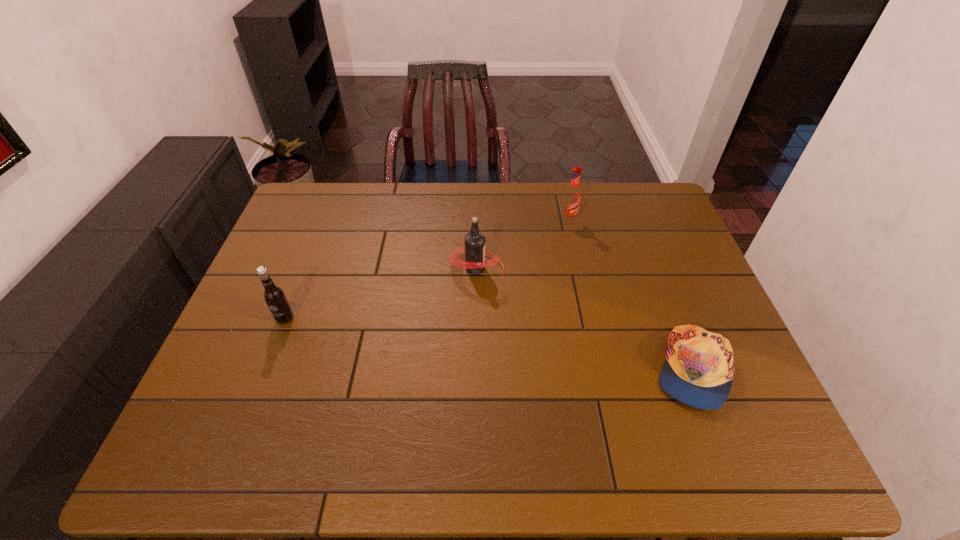
Image resolution: width=960 pixels, height=540 pixels. I want to click on the rightmost root beer, so click(571, 200).

Where is `the second object from right to left`? The image size is (960, 540). the second object from right to left is located at coordinates (571, 200).

Locate an element on the screen. Image resolution: width=960 pixels, height=540 pixels. the third nearest object is located at coordinates (475, 242).

You are a GUI agent. You are given a task and a screenshot of the screen. Output one action in this format:
    pyautogui.click(x=<x>, y=<y>)
    Task: Click on the second root beer from left to right
    
    Given the screenshot: What is the action you would take?
    pyautogui.click(x=475, y=242)

At what (x,y) coordinates should I click in order to perform the action: click on the leftmost object. Please return your answer as a coordinate pair (x, y). Image resolution: width=960 pixels, height=540 pixels. Looking at the image, I should click on (274, 296).

This screenshot has height=540, width=960. I want to click on the third farthest object, so click(274, 296).

Locate an element on the screen. cap is located at coordinates (699, 368).

The width and height of the screenshot is (960, 540). In order to click on the rightmost object in this screenshot , I will do `click(699, 368)`.

The image size is (960, 540). I want to click on free region located 0.190m on the front of the farthest root beer, so click(x=578, y=268).

This screenshot has width=960, height=540. I want to click on vacant space situated 0.120m on the label of the third nearest object, so click(544, 268).